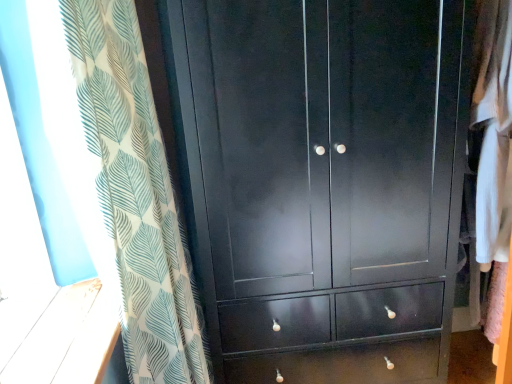
Question: Considering the positions of matte black wardrobe at center and white leaf-patterned curtain at left in the image, is matte black wardrobe at center wider or thinner than white leaf-patterned curtain at left?

Choices:
 (A) thin
 (B) wide

Answer: (B)

Question: In the image, is matte black wardrobe at center positioned in front of or behind white leaf-patterned curtain at left?

Choices:
 (A) behind
 (B) front

Answer: (A)

Question: Is matte black wardrobe at center situated inside white leaf-patterned curtain at left or outside?

Choices:
 (A) inside
 (B) outside

Answer: (B)

Question: From the image's perspective, relative to matte black wardrobe at center, is white leaf-patterned curtain at left above or below?

Choices:
 (A) above
 (B) below

Answer: (B)

Question: Is white leaf-patterned curtain at left in front of or behind matte black wardrobe at center in the image?

Choices:
 (A) behind
 (B) front

Answer: (B)

Question: From a real-world perspective, relative to matte black wardrobe at center, is white leaf-patterned curtain at left vertically above or below?

Choices:
 (A) below
 (B) above

Answer: (B)

Question: Is white leaf-patterned curtain at left inside or outside of matte black wardrobe at center?

Choices:
 (A) outside
 (B) inside

Answer: (A)